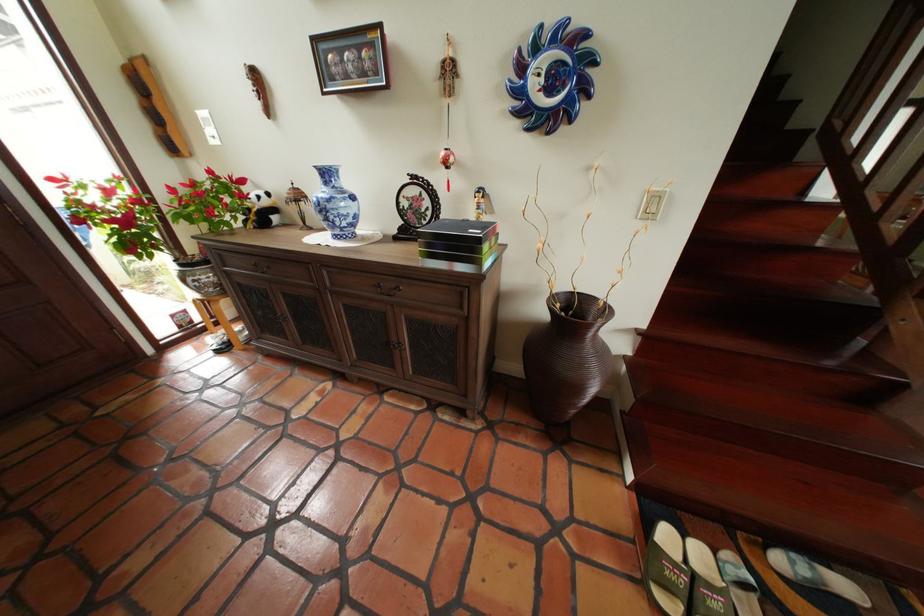
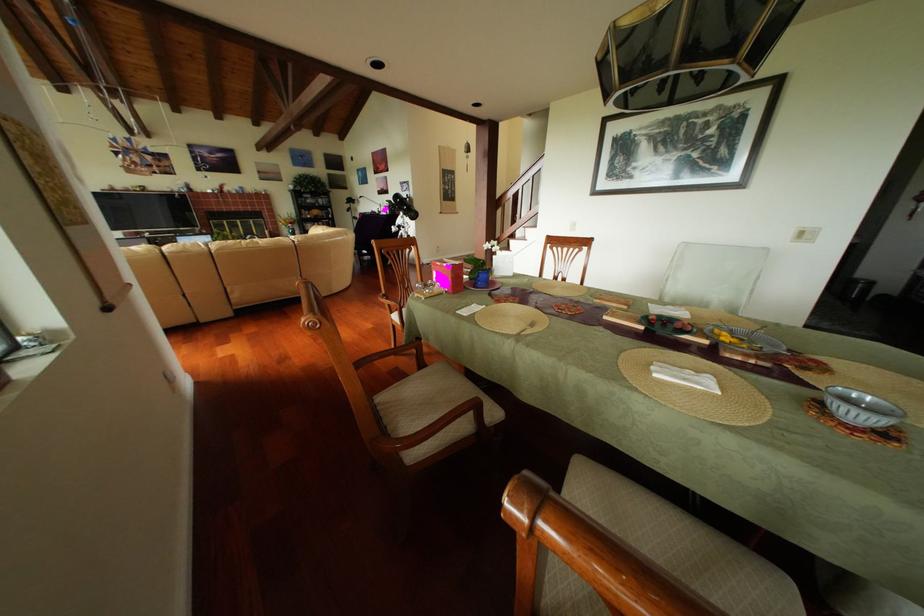
Question: I am providing you with two images of the same scene from different viewpoints. Please identify which objects are invisible in image2.

Choices:
 (A) black box
 (B) blue flower pot
 (C) grey patterned bowl
 (D) green can

Answer: (A)